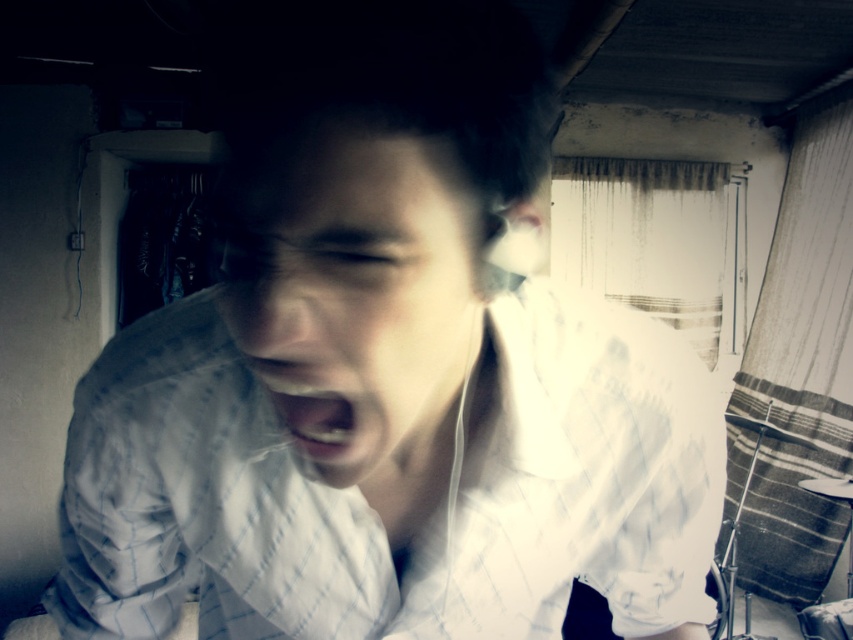
Question: In this image, where is matte white earphones at center located relative to white glossy teeth at center?

Choices:
 (A) left
 (B) right

Answer: (B)

Question: Which of the following is the closest to the observer?

Choices:
 (A) (332, 412)
 (B) (444, 438)

Answer: (A)

Question: Is matte white earphones at center smaller than white glossy teeth at center?

Choices:
 (A) no
 (B) yes

Answer: (A)

Question: Can you confirm if matte white earphones at center is smaller than white glossy teeth at center?

Choices:
 (A) no
 (B) yes

Answer: (A)